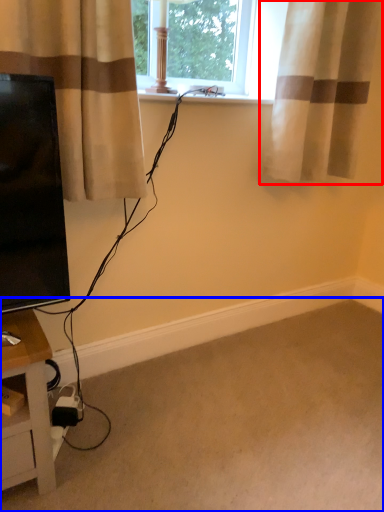
Question: Which object appears farthest to the camera in this image, curtain (highlighted by a red box) or plain (highlighted by a blue box)?

Choices:
 (A) curtain
 (B) plain

Answer: (A)